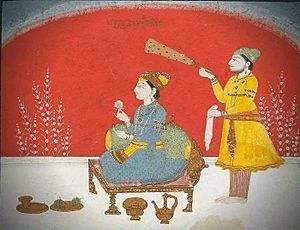
This screenshot has height=230, width=300. I want to click on cups, so click(x=166, y=212), click(x=128, y=207).